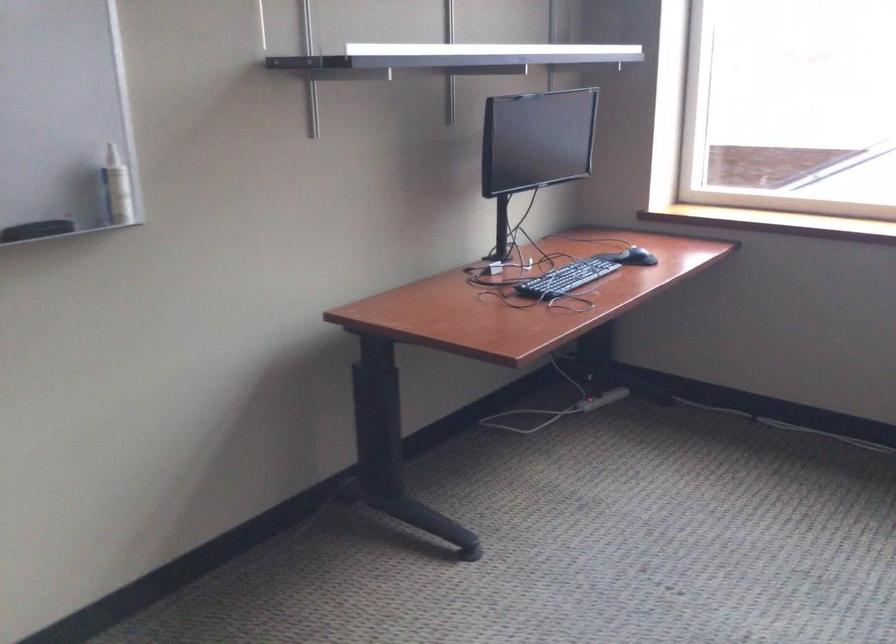
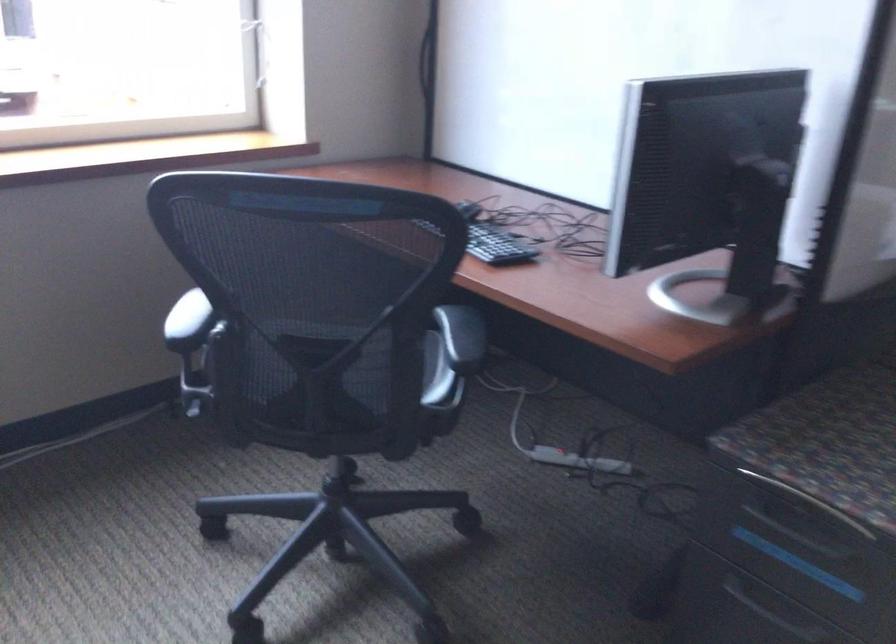
Question: The camera is either moving clockwise (left) or counter-clockwise (right) around the object. The first image is from the beginning of the video and the second image is from the end. Is the camera moving left or right when shooting the video?

Choices:
 (A) Left
 (B) Right

Answer: (A)